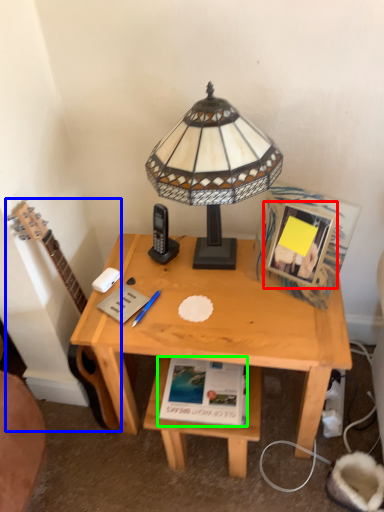
Question: Estimate the real-world distances between objects in this image. Which object is farther from picture frame (highlighted by a red box), guitar (highlighted by a blue box) or paperback book (highlighted by a green box)?

Choices:
 (A) guitar
 (B) paperback book

Answer: (A)